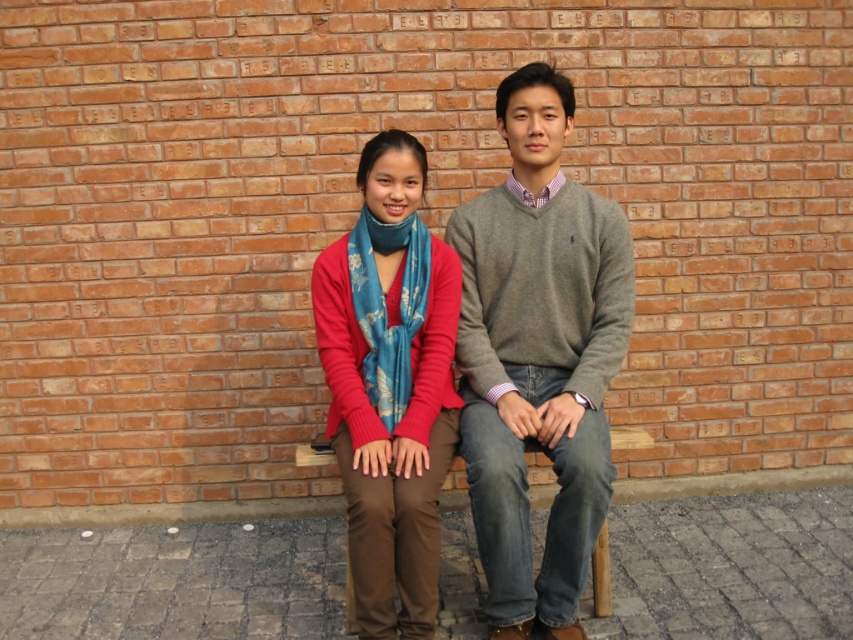
Question: Can you confirm if gray sweater at center is positioned above matte blue scarf at center?

Choices:
 (A) no
 (B) yes

Answer: (B)

Question: Considering the relative positions of gray sweater at center and matte blue scarf at center in the image provided, where is gray sweater at center located with respect to matte blue scarf at center?

Choices:
 (A) left
 (B) right

Answer: (B)

Question: Which point is farther to the camera?

Choices:
 (A) (376, 593)
 (B) (518, 116)

Answer: (B)

Question: Is gray sweater at center below matte blue scarf at center?

Choices:
 (A) yes
 (B) no

Answer: (B)